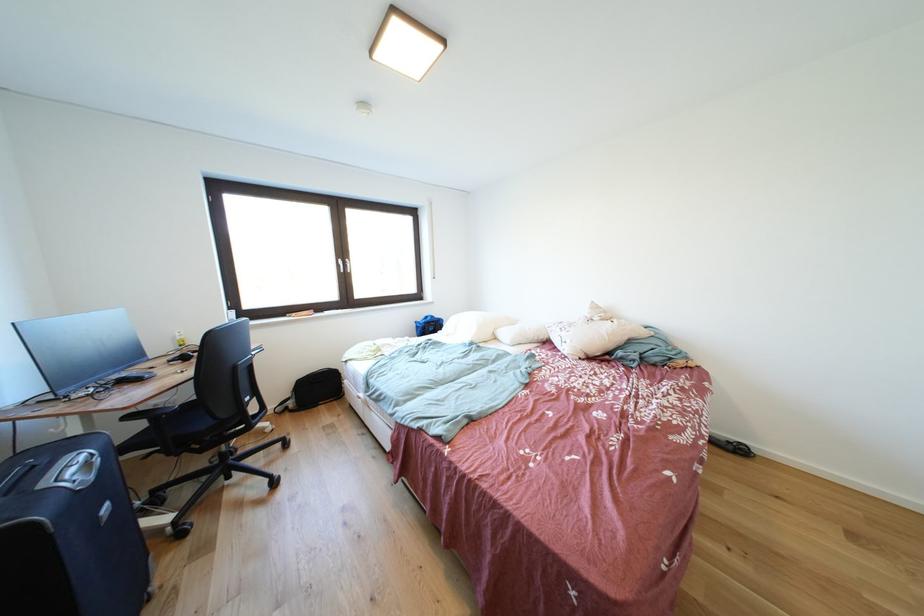
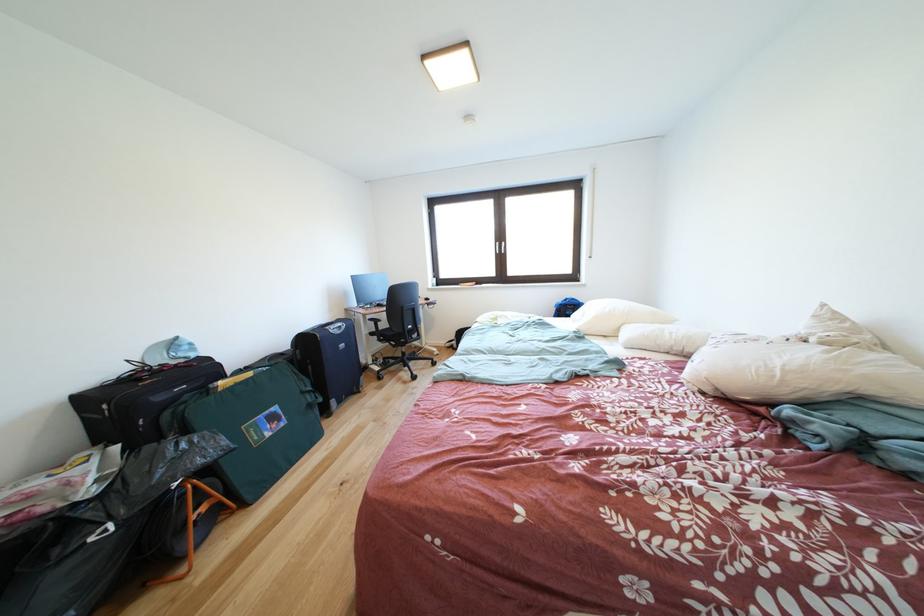
Locate, in the second image, the point that corresponds to [441,326] in the first image.

(578, 310)